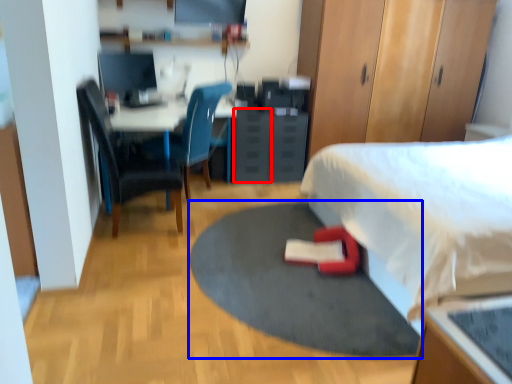
Question: Which of the following is the closest to the observer, drawer (highlighted by a red box) or yoga mat (highlighted by a blue box)?

Choices:
 (A) drawer
 (B) yoga mat

Answer: (B)